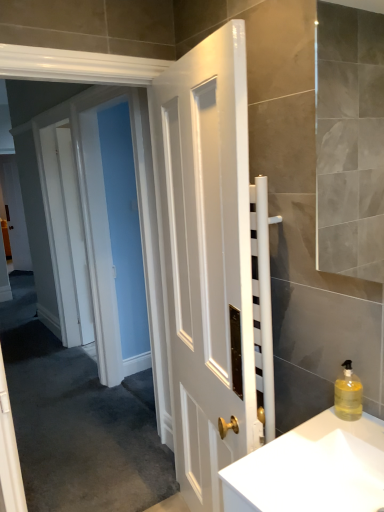
Where is `white glossy sink at lower right`? white glossy sink at lower right is located at coordinates (312, 469).

Where is `translucent yellow liquid at right`? This screenshot has width=384, height=512. translucent yellow liquid at right is located at coordinates (348, 394).

Who is bigger, white glossy sink at lower right or white glossy door at left?

With larger size is white glossy door at left.

Is the position of white glossy sink at lower right less distant than that of white glossy door at left?

Yes, white glossy sink at lower right is closer to the viewer.

Measure the distance from white glossy sink at lower right to white glossy door at left.

A distance of 9.49 feet exists between white glossy sink at lower right and white glossy door at left.

Is white glossy sink at lower right to the right of white glossy door at left from the viewer's perspective?

Correct, you'll find white glossy sink at lower right to the right of white glossy door at left.

Considering the sizes of translucent yellow liquid at right and white glossy sink at lower right in the image, is translucent yellow liquid at right wider or thinner than white glossy sink at lower right?

In the image, translucent yellow liquid at right appears to be more narrow than white glossy sink at lower right.

Is translucent yellow liquid at right in contact with white glossy sink at lower right?

translucent yellow liquid at right and white glossy sink at lower right are clearly separated.

Does translucent yellow liquid at right have a smaller size compared to white glossy sink at lower right?

Correct, translucent yellow liquid at right occupies less space than white glossy sink at lower right.

How different are the orientations of translucent yellow liquid at right and white glossy sink at lower right in degrees?

0.991 degrees.

Is translucent yellow liquid at right with white glossy door at left?

No, translucent yellow liquid at right is not making contact with white glossy door at left.

Considering the sizes of objects translucent yellow liquid at right and white glossy door at left in the image provided, who is thinner, translucent yellow liquid at right or white glossy door at left?

Thinner between the two is translucent yellow liquid at right.

Identify the location of door on the left of translucent yellow liquid at right. The width and height of the screenshot is (384, 512). (75, 233).

Is translucent yellow liquid at right spatially inside white glossy door at left, or outside of it?

The correct answer is: outside.

Could you tell me if white glossy door at left is facing white glossy sink at lower right?

Yes, white glossy door at left is oriented towards white glossy sink at lower right.

Is white glossy door at left not near white glossy sink at lower right?

Indeed, white glossy door at left is not near white glossy sink at lower right.

Relative to white glossy sink at lower right, is white glossy door at left in front or behind?

In the image, white glossy door at left appears behind white glossy sink at lower right.

Does point (68, 210) appear closer or farther from the camera than point (346, 455)?

Point (68, 210).

Does white glossy sink at lower right touch translucent yellow liquid at right?

No, white glossy sink at lower right is not next to translucent yellow liquid at right.

From a real-world perspective, between white glossy sink at lower right and translucent yellow liquid at right, who is vertically lower?

From a 3D spatial view, white glossy sink at lower right is below.

Does white glossy sink at lower right contain translucent yellow liquid at right?

No, translucent yellow liquid at right is not inside white glossy sink at lower right.

Which is in front, white glossy sink at lower right or translucent yellow liquid at right?

white glossy sink at lower right is closer to the camera.

From the picture: Is translucent yellow liquid at right at the back of white glossy door at left?

No.

In terms of height, does white glossy door at left look taller or shorter compared to translucent yellow liquid at right?

white glossy door at left is taller than translucent yellow liquid at right.

Is white glossy door at left not close to translucent yellow liquid at right?

Yes, white glossy door at left and translucent yellow liquid at right are located far from each other.

You are a GUI agent. You are given a task and a screenshot of the screen. Output one action in this format:
    pyautogui.click(x=<x>, y=<y>)
    Task: Click on the sink in front of the white glossy door at left
    
    Given the screenshot: What is the action you would take?
    pyautogui.click(x=312, y=469)

Locate an element on the screen. sink located on the left of translucent yellow liquid at right is located at coordinates (312, 469).

Estimate the real-world distances between objects in this image. Which object is further from white glossy sink at lower right, translucent yellow liquid at right or white glossy door at left?

Among the two, white glossy door at left is located further to white glossy sink at lower right.

From the image, which object appears to be farther from white glossy door at left, translucent yellow liquid at right or white glossy sink at lower right?

translucent yellow liquid at right is further to white glossy door at left.

Estimate the real-world distances between objects in this image. Which object is further from white glossy sink at lower right, white glossy door at left or translucent yellow liquid at right?

The object further to white glossy sink at lower right is white glossy door at left.

When comparing their distances from translucent yellow liquid at right, does white glossy sink at lower right or white glossy door at left seem further?

white glossy door at left lies further to translucent yellow liquid at right than the other object.

From the image, which object appears to be farther from translucent yellow liquid at right, white glossy door at left or white glossy sink at lower right?

The object further to translucent yellow liquid at right is white glossy door at left.

When comparing their distances from white glossy door at left, does white glossy sink at lower right or translucent yellow liquid at right seem further?

translucent yellow liquid at right lies further to white glossy door at left than the other object.

Where is `soap dispenser between white glossy sink at lower right and white glossy door at left from front to back`? The width and height of the screenshot is (384, 512). soap dispenser between white glossy sink at lower right and white glossy door at left from front to back is located at coordinates (348, 394).